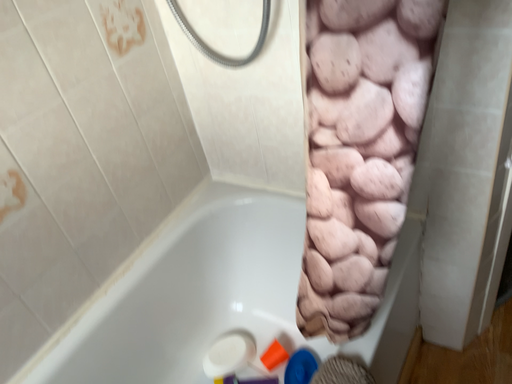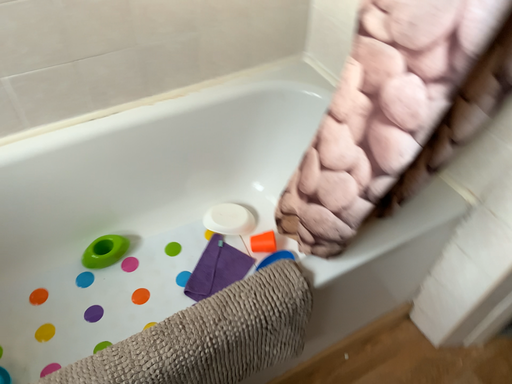
Question: How did the camera likely rotate when shooting the video?

Choices:
 (A) rotated downward
 (B) rotated upward

Answer: (A)